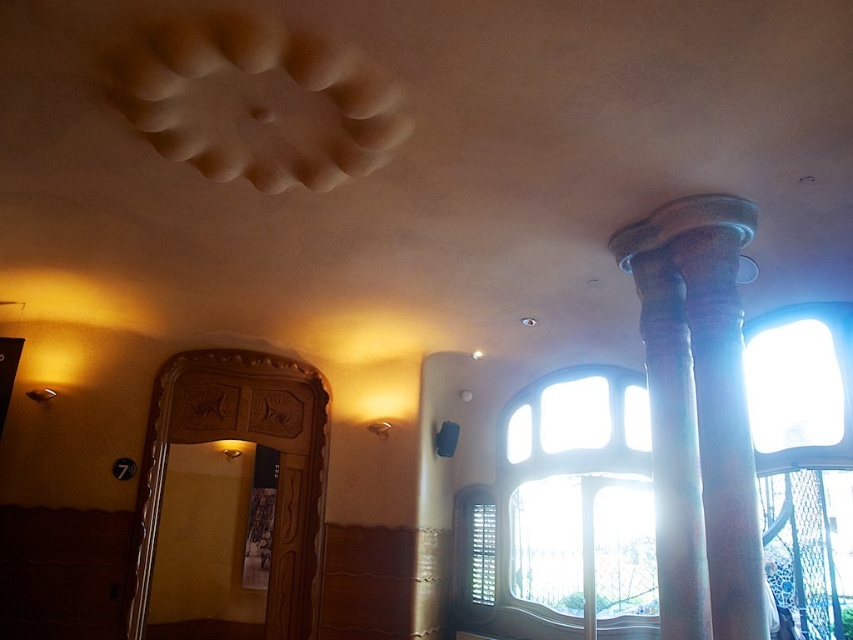
You are an interior designer assessing the space for a new piece of furniture. You notice the smooth stone column at right and the clear glass window at center. Which of these two objects takes up more area in the room?

The clear glass window at center takes up more area in the room than the smooth stone column at right because the smooth stone column at right occupies less space than clear glass window at center.

You are standing in the room and want to exit through the door on the left. To avoid bumping into the smooth stone column at right, should you walk to the left or right of the clear glass window at center?

You should walk to the left of the clear glass window at center because the smooth stone column at right is positioned on the right side of the clear glass window at center, so moving left would keep you clear of the column.